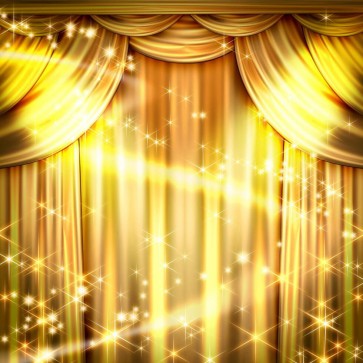
Image resolution: width=363 pixels, height=363 pixels. In order to click on spotlight in this screenshot , I will do `click(61, 118)`, `click(308, 100)`.